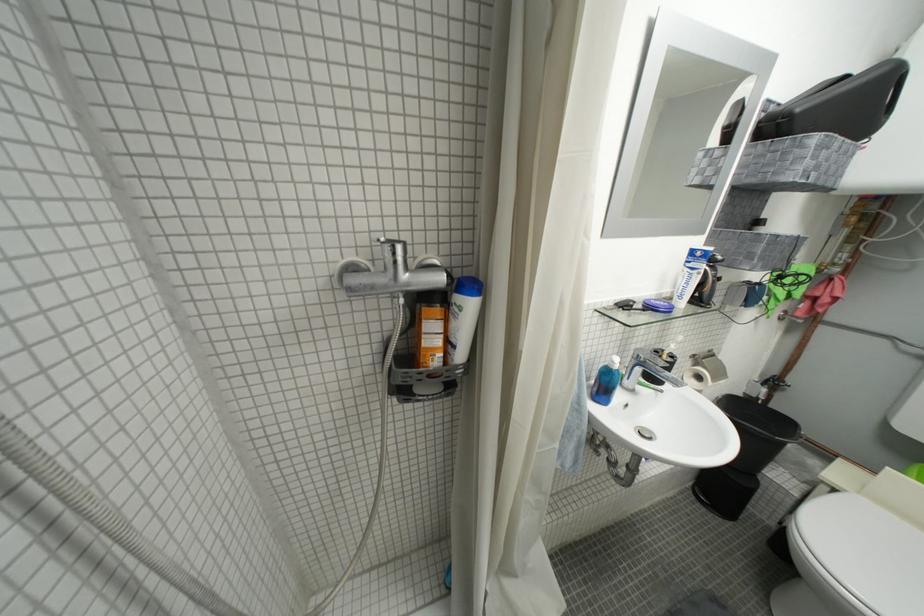
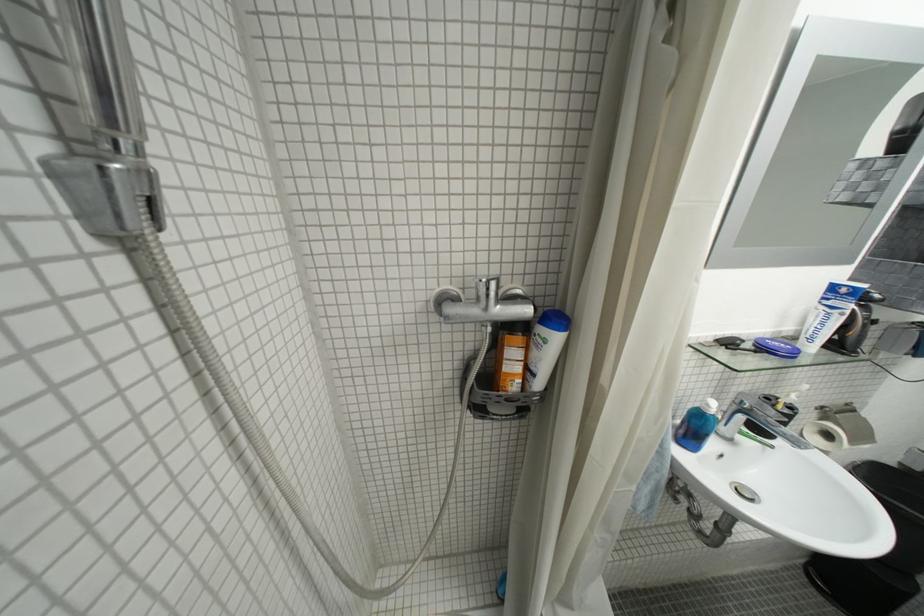
Where in the second image is the point corresponding to (x=432, y=339) from the first image?

(514, 363)